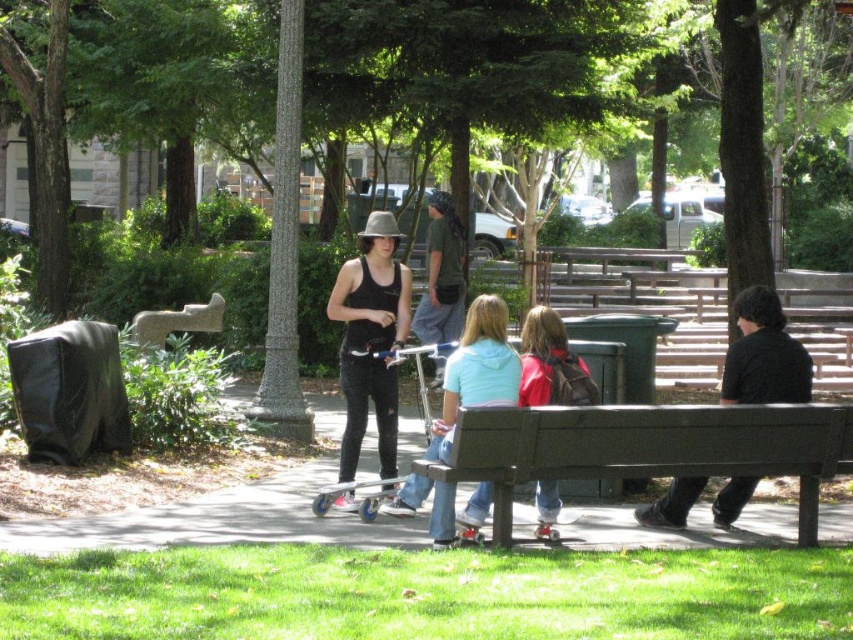
Which of these two, black cotton shirt at right or light blue cotton hoodie at center, stands taller?

light blue cotton hoodie at center

Which is in front, point (775, 397) or point (410, 476)?

Point (775, 397)

Image resolution: width=853 pixels, height=640 pixels. I want to click on black cotton shirt at right, so 763,355.

Find the location of a particular element. black cotton shirt at right is located at coordinates (763, 355).

Between matte black tank top at center and black cotton shirt at right, which one is positioned lower?

Positioned lower is matte black tank top at center.

Who is more distant from viewer, (369,380) or (769,352)?

The point (369,380) is behind.

The image size is (853, 640). What are the coordinates of `matte black tank top at center` in the screenshot? It's located at (370, 339).

Between wooden bench at center and gray stone bench at center, which one appears on the left side from the viewer's perspective?

Positioned to the left is gray stone bench at center.

Does wooden bench at center have a lesser width compared to gray stone bench at center?

In fact, wooden bench at center might be wider than gray stone bench at center.

Is point (535, 445) positioned after point (163, 342)?

No, (535, 445) is closer to viewer.

You are a GUI agent. You are given a task and a screenshot of the screen. Output one action in this format:
    pyautogui.click(x=<x>, y=<y>)
    Task: Click on the wooden bench at center
    The height and width of the screenshot is (640, 853).
    Given the screenshot: What is the action you would take?
    pyautogui.click(x=648, y=449)